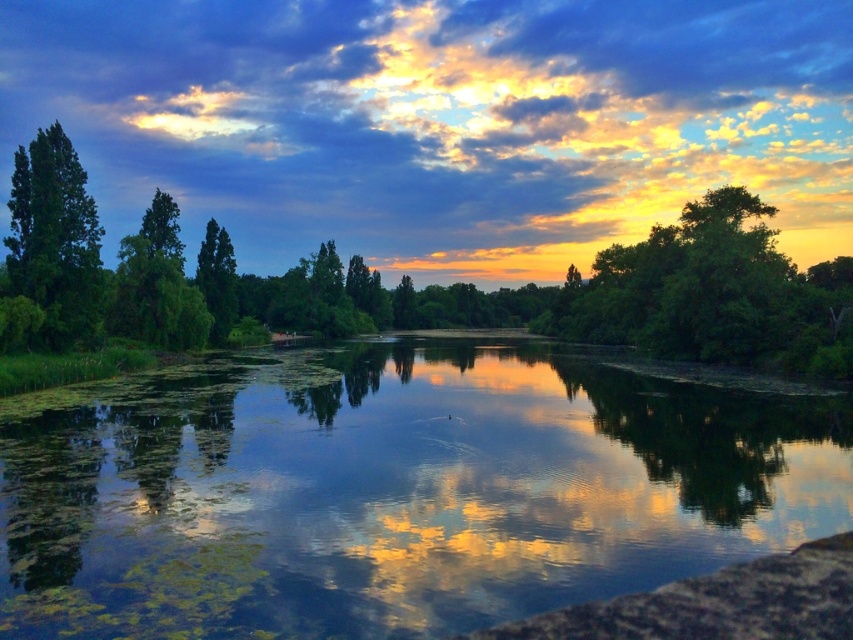
Question: Which of the following is the farthest from the observer?

Choices:
 (A) green matte tree at left
 (B) green leafy tree at center
 (C) green algae-covered water at center

Answer: (A)

Question: Does green leafy tree at center have a lesser width compared to green leafy tree at right?

Choices:
 (A) no
 (B) yes

Answer: (A)

Question: Which point is farther from the camera taking this photo?

Choices:
 (A) (62, 634)
 (B) (607, 269)

Answer: (B)

Question: Which object is farther from the camera taking this photo?

Choices:
 (A) green algae-covered water at center
 (B) green matte tree at left

Answer: (B)

Question: Is green algae-covered water at center positioned in front of green leafy tree at center?

Choices:
 (A) no
 (B) yes

Answer: (B)

Question: Can you confirm if green algae-covered water at center is positioned below green leafy tree at right?

Choices:
 (A) no
 (B) yes

Answer: (B)